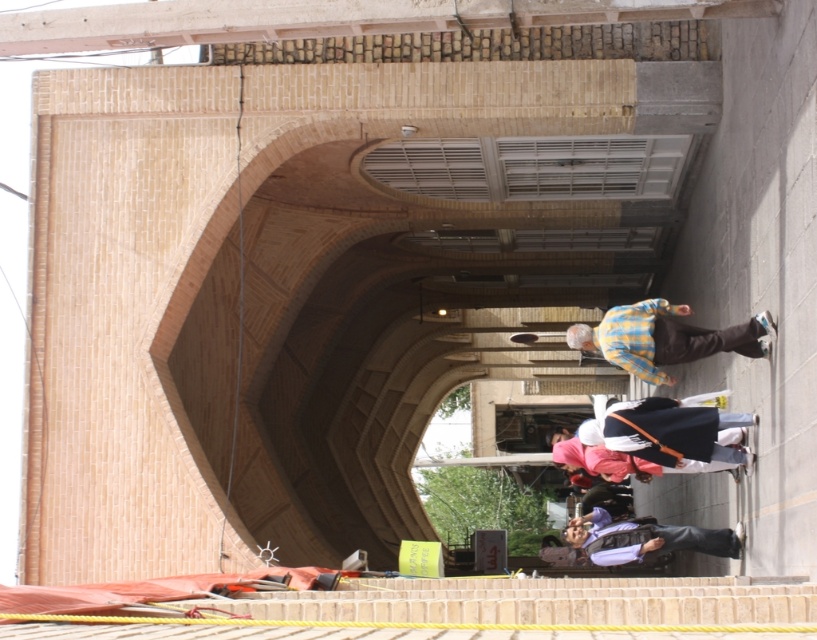
You are a worker in the arched passageway. You need to reach the plaid shirt at center and the purple fabric pants at lower center. Which item is closer to you?

The plaid shirt at center is shorter than purple fabric pants at lower center, so the plaid shirt at center is closer to you.

You are standing in the arched passageway and notice a plaid shirt at center and purple fabric pants at lower center. Which clothing item is wider?

The plaid shirt at center is wider than the purple fabric pants at lower center.